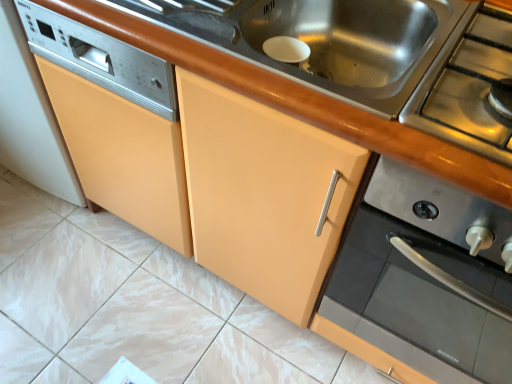
Question: From the image's perspective, is stainless steel sink at center above or below stainless steel stove at upper right?

Choices:
 (A) above
 (B) below

Answer: (A)

Question: Based on their sizes in the image, would you say stainless steel sink at center is bigger or smaller than stainless steel stove at upper right?

Choices:
 (A) big
 (B) small

Answer: (B)

Question: Which of these objects is positioned closest to the stainless steel sink at center?

Choices:
 (A) stainless steel stove at upper right
 (B) stainless steel gas stove at right

Answer: (B)

Question: Estimate the real-world distances between objects in this image. Which object is closer to the stainless steel gas stove at right?

Choices:
 (A) stainless steel sink at center
 (B) stainless steel stove at upper right

Answer: (A)